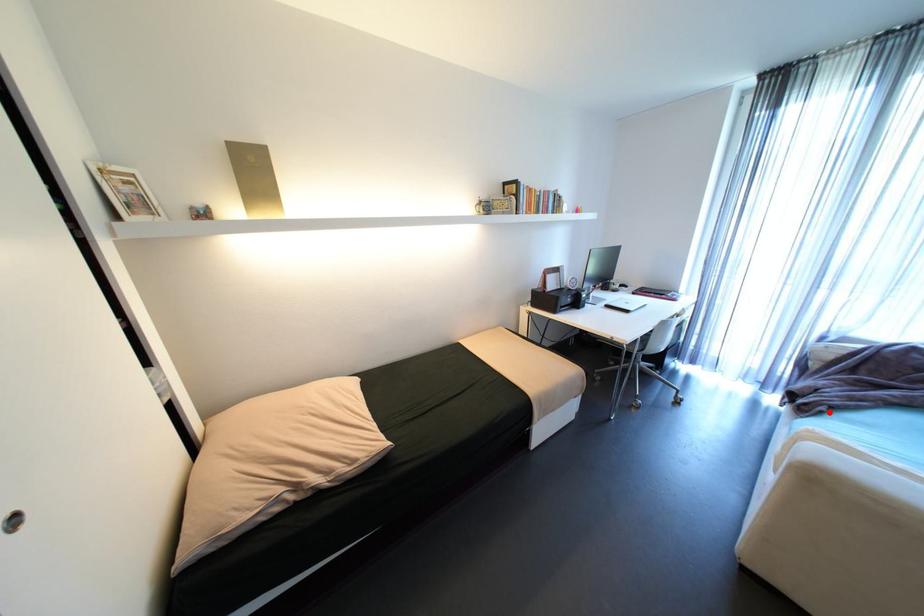
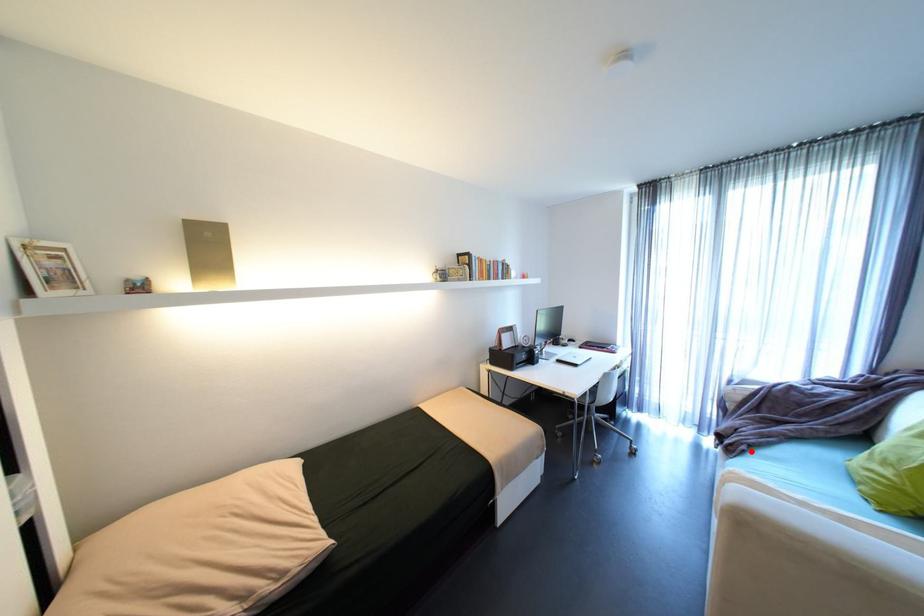
I am providing you with two images of the same scene from different viewpoints. A red point is marked on the first image and another point is marked on the second image. Are the points marked in image1 and image2 representing the same 3D position?

Yes